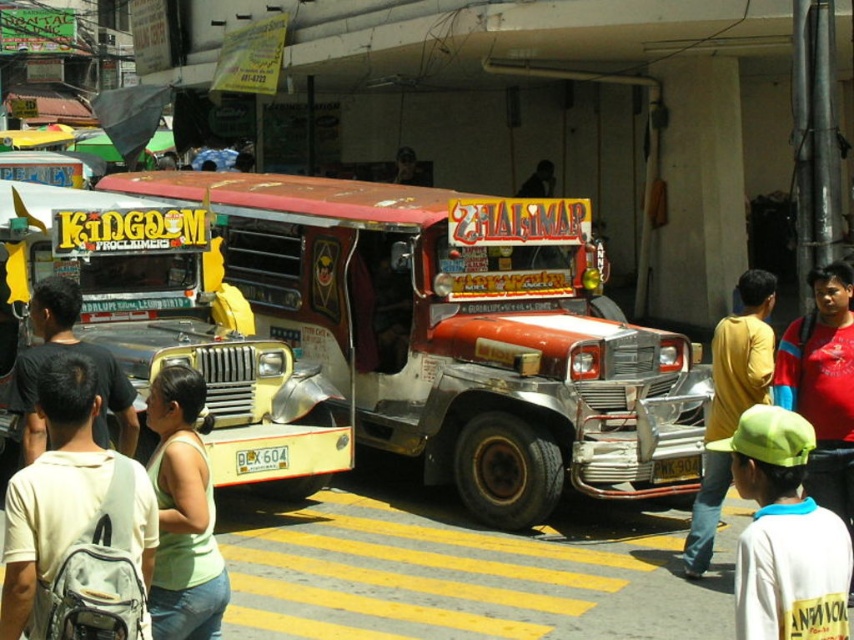
You are a photographer trying to capture the shiny red bus at center and the red matte shirt at center right in a single frame. Since the camera can only focus on one object at a time, which object should you focus on to ensure it takes up more space in the photo?

The shiny red bus at center is bigger than the red matte shirt at center right, so focusing on the shiny red bus at center will ensure it takes up more space in the photo.

You are a photographer standing at the center of the scene. You want to capture a photo of the jeepney without including the white cotton shirt at lower right in the frame. Based on its position, is the shirt likely to be in the foreground or background of your shot?

The white cotton shirt at lower right is located at point (784,534), which places it near the lower right corner of the image. Since you are positioned at the center, the shirt would be in the background and likely outside the frame if you aim the camera towards the jeepney. However, without knowing the exact camera angle and zoom, it is uncertain. To ensure exclusion, recompose the shot to avoid the lower right area.